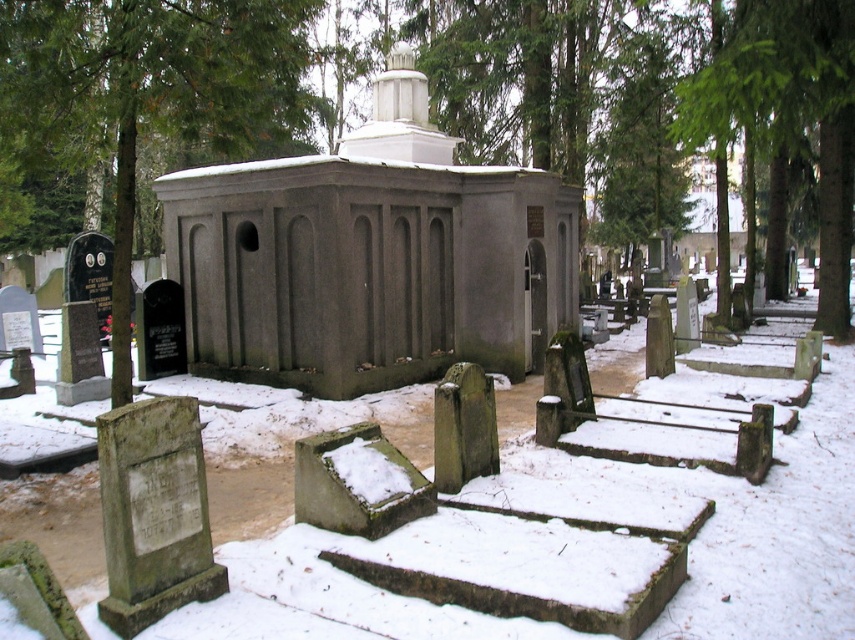
Between point (382, 356) and point (151, 120), which one is positioned behind?

The point (382, 356) is behind.

Is gray concrete church at center above green textured tree at left?

No.

Between point (252, 236) and point (45, 38), which one is positioned behind?

Positioned behind is point (252, 236).

You are a GUI agent. You are given a task and a screenshot of the screen. Output one action in this format:
    pyautogui.click(x=<x>, y=<y>)
    Task: Click on the gray concrete church at center
    The width and height of the screenshot is (855, 640).
    Given the screenshot: What is the action you would take?
    pyautogui.click(x=370, y=257)

Can you confirm if green textured tree at left is thinner than green textured tree at center?

Indeed, green textured tree at left has a lesser width compared to green textured tree at center.

Who is more distant from viewer, (252, 115) or (723, 102)?

Point (723, 102)

Find the location of `green textured tree at left`. green textured tree at left is located at coordinates (146, 81).

Is point (257, 234) less distant than point (743, 33)?

Yes, point (257, 234) is in front of point (743, 33).

Can you confirm if gray concrete church at center is thinner than green textured tree at center?

Yes.

Between point (434, 369) and point (820, 292), which one is positioned behind?

The point (820, 292) is more distant.

This screenshot has width=855, height=640. What are the coordinates of `gray concrete church at center` in the screenshot? It's located at [x=370, y=257].